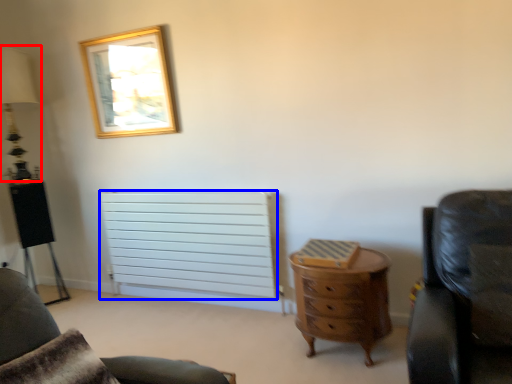
Question: Which object is closer to the camera taking this photo, table lamp (highlighted by a red box) or radiator (highlighted by a blue box)?

Choices:
 (A) table lamp
 (B) radiator

Answer: (B)